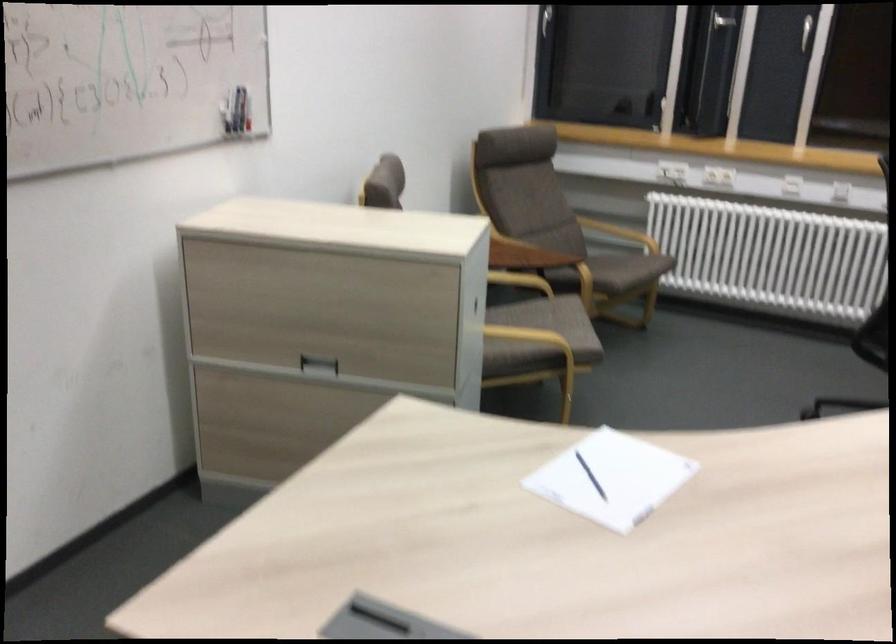
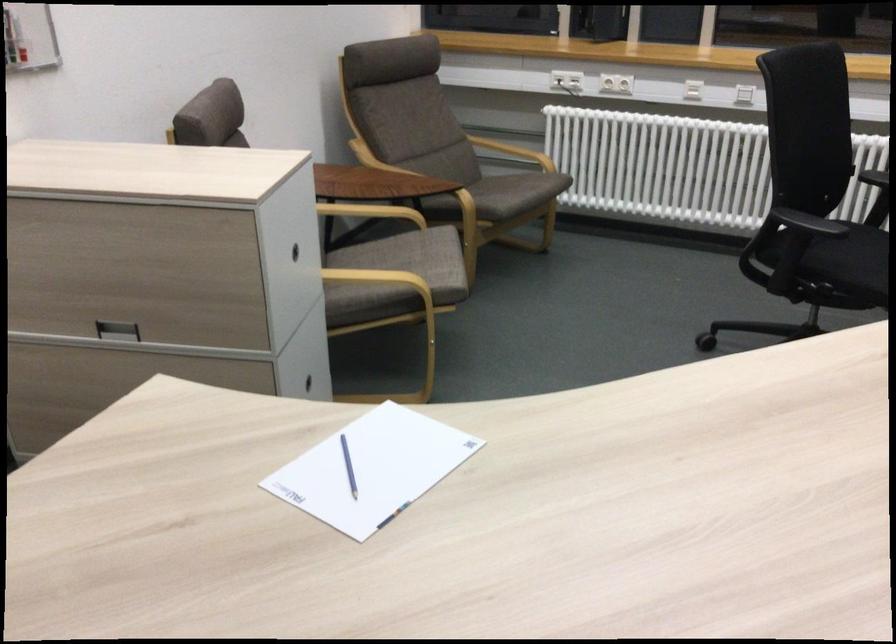
In the second image, find the point that corresponds to the point at 625,230 in the first image.

(512, 152)